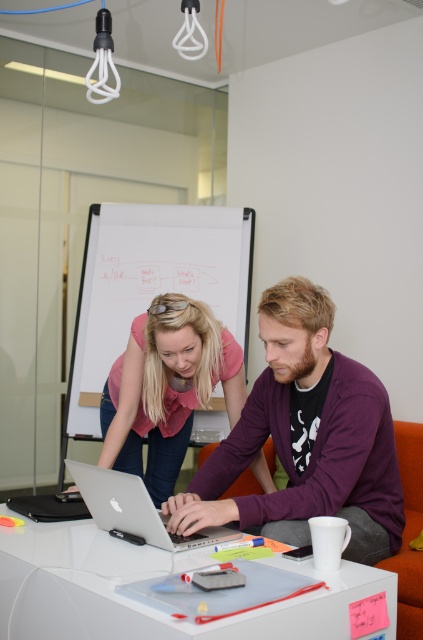
Is purple matte shirt at center wider than white plastic table at center?

No.

Between purple matte shirt at center and white plastic table at center, which one appears on the left side from the viewer's perspective?

white plastic table at center is more to the left.

Does point (354, 413) lie in front of point (32, 540)?

No.

Identify the location of purple matte shirt at center. pos(305,436).

Does white plastic table at center appear over silver metallic laptop at center?

No.

Is the position of white plastic table at center more distant than that of silver metallic laptop at center?

No, it is not.

Who is more distant from viewer, (8, 611) or (107, 481)?

Point (107, 481)

Locate an element on the screen. The width and height of the screenshot is (423, 640). white plastic table at center is located at coordinates (153, 577).

Does purple matte shirt at center appear over silver metallic laptop at center?

Indeed, purple matte shirt at center is positioned over silver metallic laptop at center.

Is purple matte shirt at center bigger than silver metallic laptop at center?

Yes, purple matte shirt at center is bigger than silver metallic laptop at center.

Measure the distance between purple matte shirt at center and camera.

A distance of 1.48 meters exists between purple matte shirt at center and camera.

Find the location of a particular element. purple matte shirt at center is located at coordinates (305, 436).